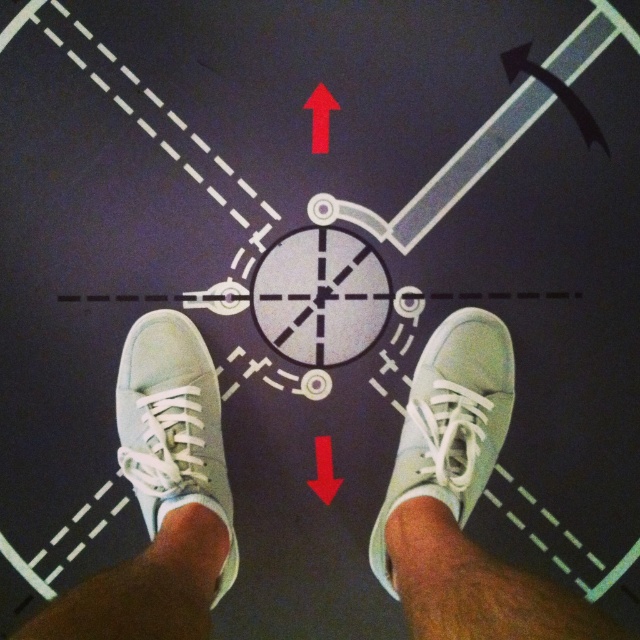
Is metallic gray circle at center wider than light skin at center?

Indeed, metallic gray circle at center has a greater width compared to light skin at center.

The width and height of the screenshot is (640, 640). Describe the element at coordinates (321, 296) in the screenshot. I see `metallic gray circle at center` at that location.

Identify the location of metallic gray circle at center. [321, 296].

Measure the distance from light skin at center to suede-like skin at lower center.

14.67 inches

Can you confirm if light skin at center is taller than suede-like skin at lower center?

Correct, light skin at center is much taller as suede-like skin at lower center.

Between point (390, 556) and point (164, 513), which one is positioned behind?

The point (390, 556) is behind.

Where is `light skin at center`? light skin at center is located at coordinates (410, 528).

Is light blue suede shoe at center above light skin at center?

Correct, light blue suede shoe at center is located above light skin at center.

I want to click on light blue suede shoe at center, so click(451, 422).